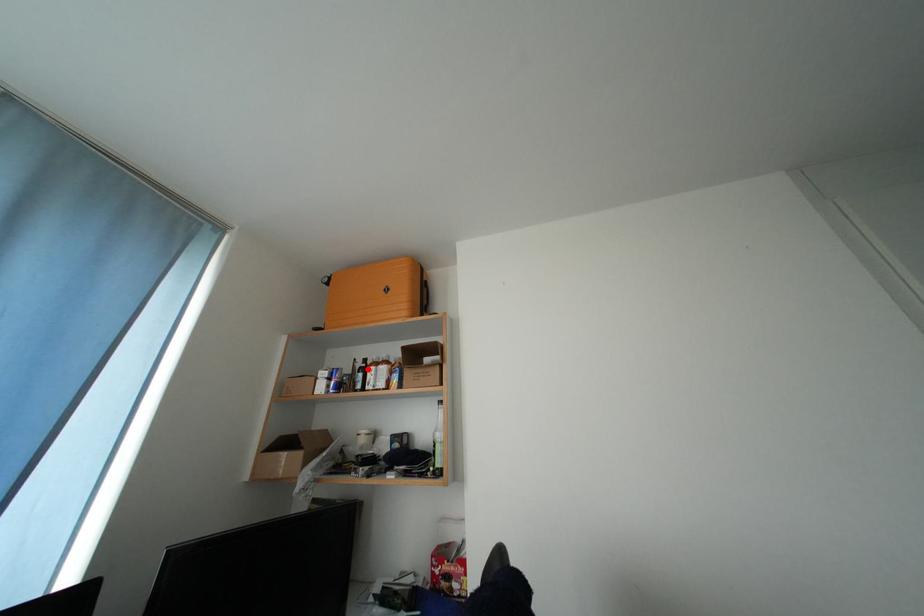
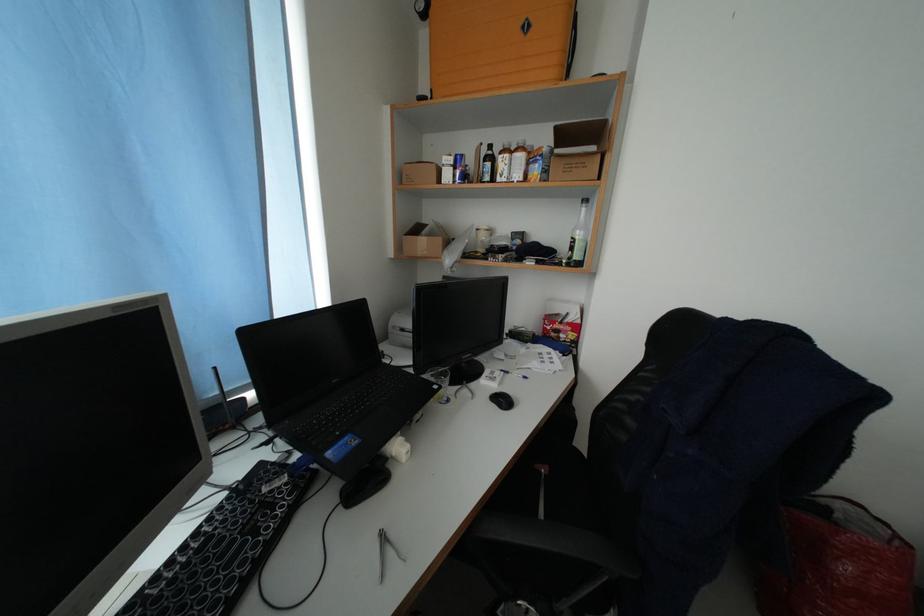
Locate, in the second image, the point that corresponds to the highlighted location in the first image.

(492, 156)